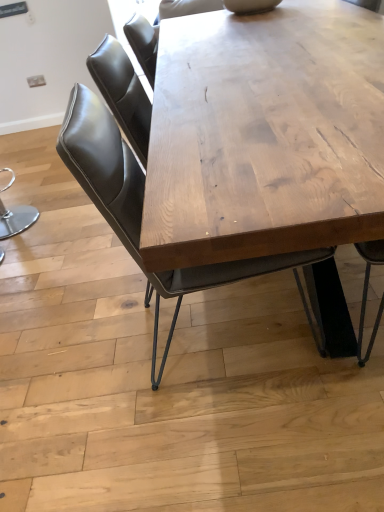
Question: Choose the correct answer: Is leather seat at center inside natural wood table at center or outside it?

Choices:
 (A) inside
 (B) outside

Answer: (A)

Question: From the image's perspective, is leather seat at center above or below natural wood table at center?

Choices:
 (A) below
 (B) above

Answer: (A)

Question: Is leather seat at center in front of or behind natural wood table at center in the image?

Choices:
 (A) behind
 (B) front

Answer: (A)

Question: Considering the relative positions of natural wood table at center and leather seat at center in the image provided, is natural wood table at center to the left or to the right of leather seat at center?

Choices:
 (A) left
 (B) right

Answer: (B)

Question: Looking at the image, does natural wood table at center seem bigger or smaller compared to leather seat at center?

Choices:
 (A) big
 (B) small

Answer: (A)

Question: Is natural wood table at center wider or thinner than leather seat at center?

Choices:
 (A) wide
 (B) thin

Answer: (A)

Question: Is point (206, 138) positioned closer to the camera than point (173, 283)?

Choices:
 (A) closer
 (B) farther

Answer: (A)